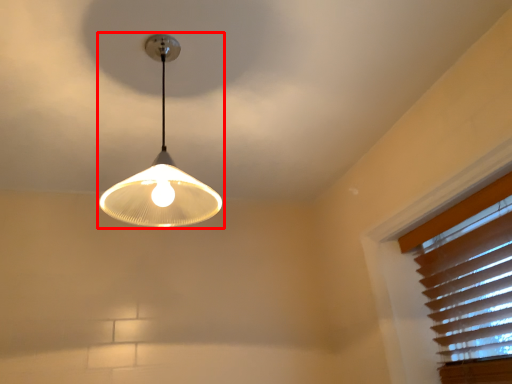
Question: From the image's perspective, what is the correct spatial relationship of lamp (annotated by the red box) in relation to blind?

Choices:
 (A) above
 (B) below

Answer: (A)